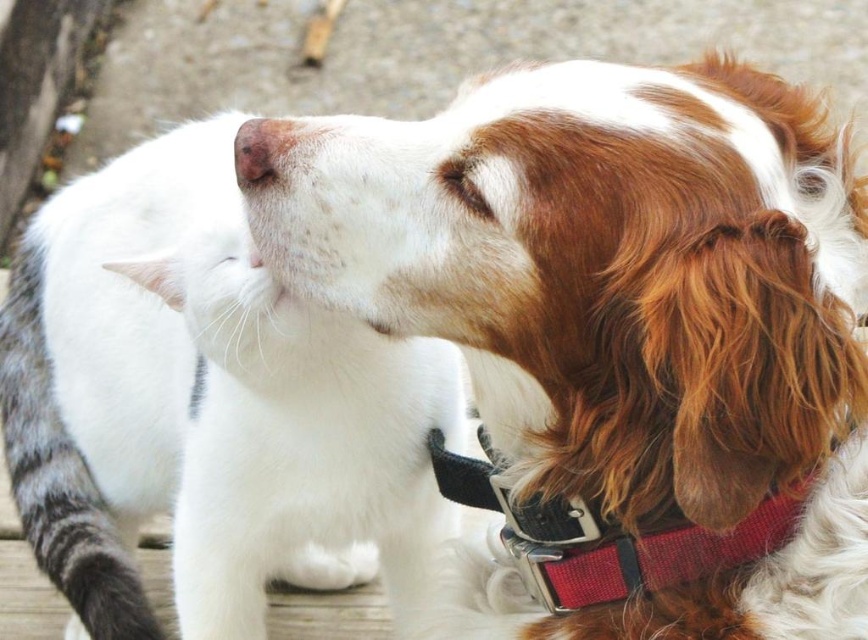
You are a photographer trying to capture a closeup of the white fur at center and the red fabric collar at right. The camera can only focus on objects within a 10 cm range. Can both objects be in focus at the same time?

The white fur at center is 9.85 centimeters from the red fabric collar at right, so yes, both objects can be in focus since the distance between them is within the camera focus range of 10 cm.

You are a photographer trying to capture the interaction between the white cat and the dog with brown and white fur. The cat is on the left, and the dog is on the right. You want to ensure that both animals are in focus. Given that your camera has a depth of field that can cover objects up to 30 inches apart, will you be able to capture both the white cat and the dog with the white fur at center in focus?

The white cat and the dog with brown and white fur are 30.51 inches apart. Since the camera can cover up to 30 inches, the distance is slightly beyond the depth of field range. Therefore, it might be challenging to keep both in focus without adjusting the settings.

You are a photographer trying to capture the interaction between the white fur at center and the red fabric collar at right. Which object is positioned higher in the frame?

The white fur at center is located above the red fabric collar at right, so it is positioned higher in the frame.